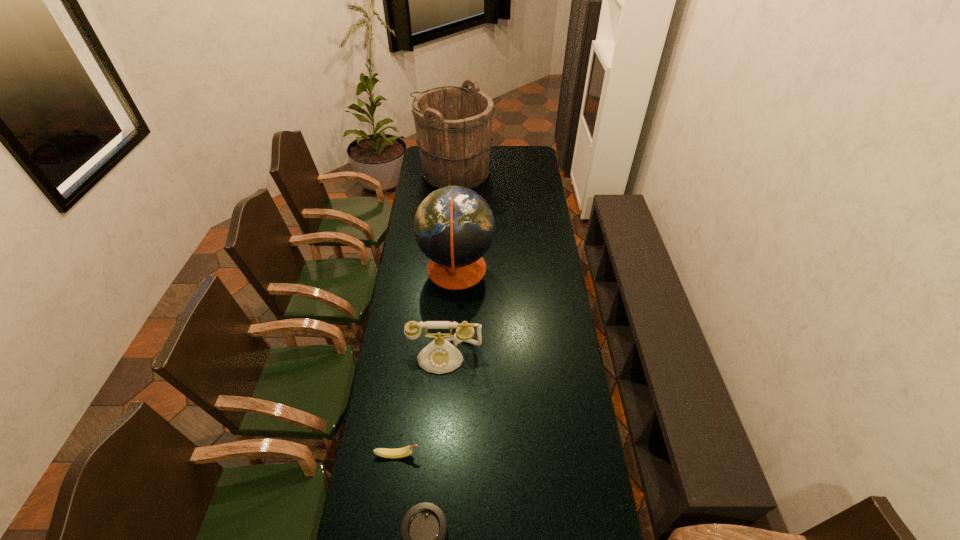
At what (x,y) coordinates should I click in order to perform the action: click on object located in the far edge section of the desktop. Please return your answer as a coordinate pair (x, y). This screenshot has height=540, width=960. Looking at the image, I should click on (453, 124).

The image size is (960, 540). What are the coordinates of `bucket present at the left edge` in the screenshot? It's located at (453, 124).

Where is `globe positioned at the left edge`? The height and width of the screenshot is (540, 960). globe positioned at the left edge is located at coordinates (454, 227).

Identify the location of telephone at the left edge. This screenshot has width=960, height=540. (440, 356).

The image size is (960, 540). Identify the location of banana located in the left edge section of the desktop. [405, 451].

Find the location of a particular element. This screenshot has height=540, width=960. object at the far left corner is located at coordinates (453, 124).

In the image, there is a desktop. Where is `vacant space at the far edge`? This screenshot has width=960, height=540. vacant space at the far edge is located at coordinates (503, 148).

At what (x,y) coordinates should I click in order to perform the action: click on vacant position at the left edge of the desktop. Please return your answer as a coordinate pair (x, y). Looking at the image, I should click on (410, 225).

Where is `vacant space at the right edge of the desktop`? The height and width of the screenshot is (540, 960). vacant space at the right edge of the desktop is located at coordinates (602, 522).

I want to click on blank region between the farthest object and the shortest object, so click(x=426, y=314).